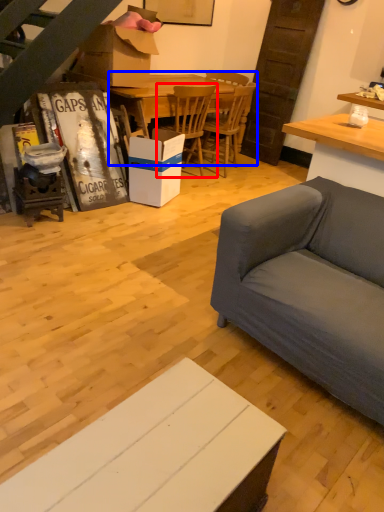
Question: Among these objects, which one is farthest to the camera, chair (highlighted by a red box) or kitchen & dining room table (highlighted by a blue box)?

Choices:
 (A) chair
 (B) kitchen & dining room table

Answer: (A)